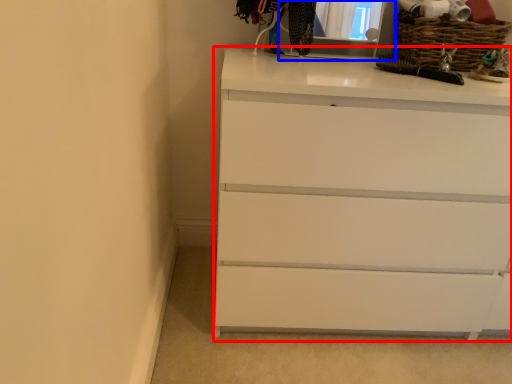
Question: Which object appears closest to the camera in this image, chest of drawers (highlighted by a red box) or medicine cabinet (highlighted by a blue box)?

Choices:
 (A) chest of drawers
 (B) medicine cabinet

Answer: (A)